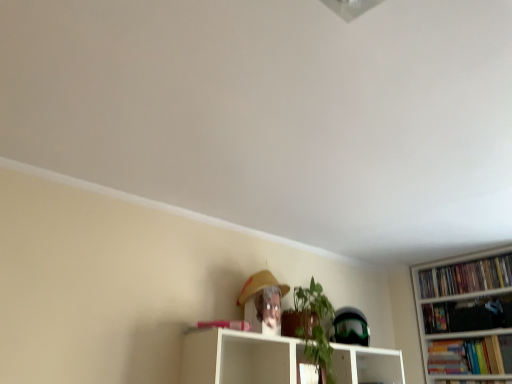
Question: Considering the positions of point (510, 344) and point (445, 276), is point (510, 344) closer or farther from the camera than point (445, 276)?

Choices:
 (A) closer
 (B) farther

Answer: (A)

Question: Relative to hardcover books at right, arranged as the first book when viewed from the top, is hardcover book at right, arranged as the second book when viewed from the top, in front or behind?

Choices:
 (A) front
 (B) behind

Answer: (A)

Question: Which of these objects is positioned farthest from the white glossy shelf at center?

Choices:
 (A) hardcover book at right, arranged as the second book when viewed from the top
 (B) matte yellow straw hat at upper center
 (C) hardcover books at right, arranged as the first book when viewed from the top

Answer: (C)

Question: Considering the real-world distances, which object is closest to the matte yellow straw hat at upper center?

Choices:
 (A) white glossy shelf at center
 (B) hardcover books at right, the 2th book in the bottom-to-top sequence
 (C) hardcover book at right, the first book when ordered from bottom to top

Answer: (A)